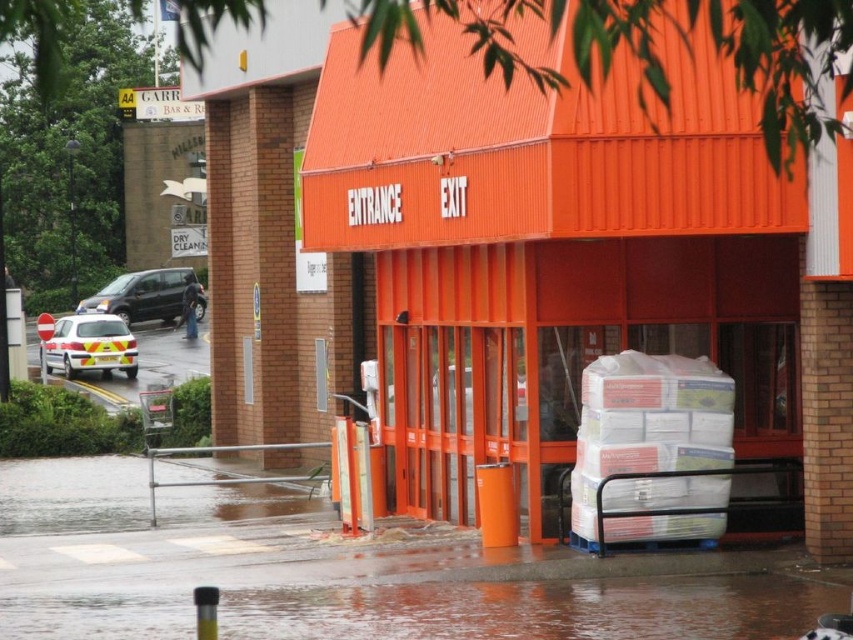
Is wet concrete flood at lower left closer to camera compared to matte black suv at left?

Yes, it is.

What do you see at coordinates (73, 493) in the screenshot? I see `wet concrete flood at lower left` at bounding box center [73, 493].

Is point (204, 513) in front of point (199, 314)?

Yes, it is in front of point (199, 314).

Find the location of a particular element. wet concrete flood at lower left is located at coordinates (73, 493).

Can you confirm if wet concrete flood at lower center is bigger than matte black suv at left?

Incorrect, wet concrete flood at lower center is not larger than matte black suv at left.

Can you confirm if wet concrete flood at lower center is positioned to the right of matte black suv at left?

Yes, wet concrete flood at lower center is to the right of matte black suv at left.

Measure the distance between point (521,616) and camera.

Point (521,616) is 11.70 meters from camera.

This screenshot has height=640, width=853. Find the location of `wet concrete flood at lower center`. wet concrete flood at lower center is located at coordinates (442, 609).

Locate an element on the screen. wet concrete flood at lower left is located at coordinates (73, 493).

At what (x,y) coordinates should I click in order to perform the action: click on wet concrete flood at lower left. Please return your answer as a coordinate pair (x, y). Looking at the image, I should click on pos(73,493).